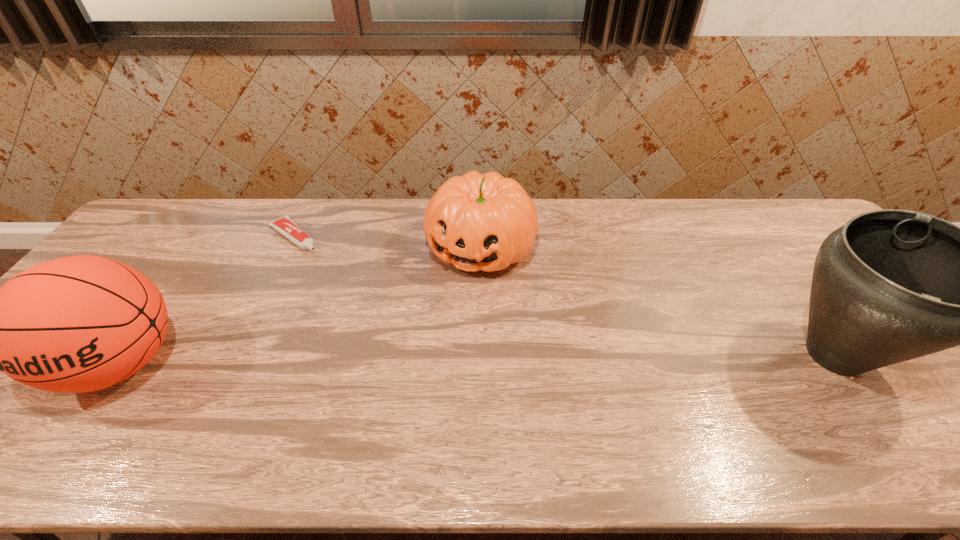
Find the location of `free spot on the desktop that is between the leftmost object and the urn and is positioned on the carved face of the pumpkin`. free spot on the desktop that is between the leftmost object and the urn and is positioned on the carved face of the pumpkin is located at coordinates (421, 360).

This screenshot has width=960, height=540. What are the coordinates of `vacant space on the desktop that is between the leftmost object and the rightmost object and is positioned at the nozzle of the toothpaste` in the screenshot? It's located at (443, 360).